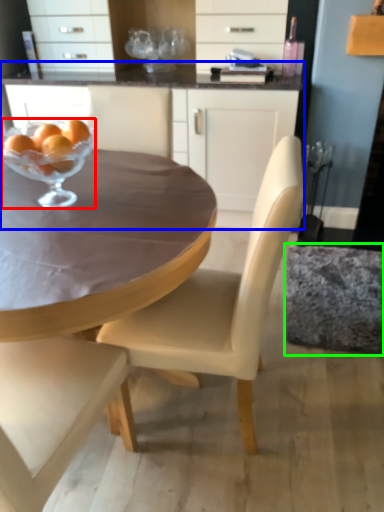
Question: Which is nearer to the martini glass (highlighted by a red box)? cabinetry (highlighted by a blue box) or swivel chair (highlighted by a green box).

Choices:
 (A) cabinetry
 (B) swivel chair

Answer: (A)